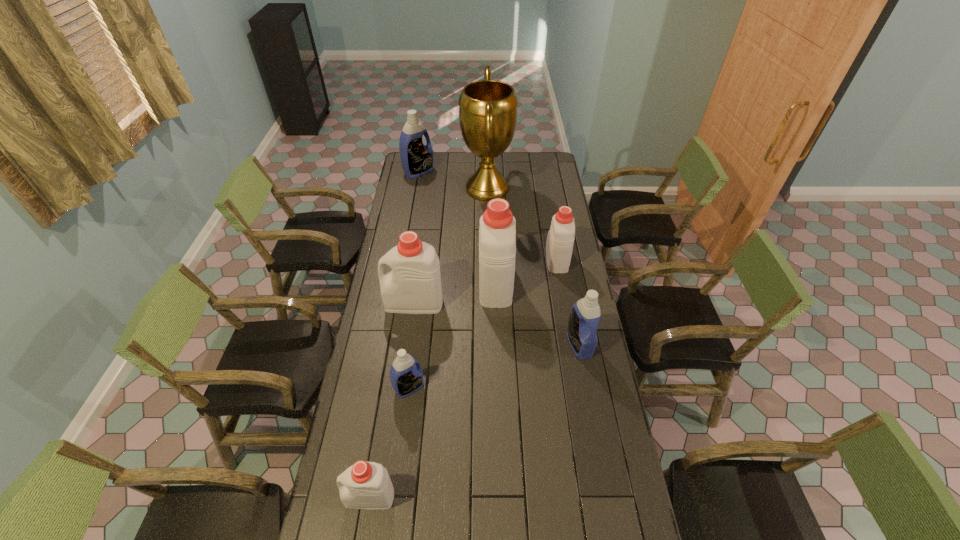
Locate an element on the screen. The width and height of the screenshot is (960, 540). trophy cup is located at coordinates (487, 108).

At what (x,y) coordinates should I click in order to perform the action: click on the tallest object. Please return your answer as a coordinate pair (x, y). The height and width of the screenshot is (540, 960). Looking at the image, I should click on (487, 108).

In order to click on the biggest white detergent in this screenshot , I will do `click(497, 233)`.

The image size is (960, 540). What are the coordinates of `the tallest detergent` in the screenshot? It's located at (497, 233).

Find the location of `the farthest detergent`. the farthest detergent is located at coordinates (417, 159).

Locate an element on the screen. The height and width of the screenshot is (540, 960). the biggest blue detergent is located at coordinates (417, 159).

Identify the location of the second biggest white detergent. (413, 286).

Image resolution: width=960 pixels, height=540 pixels. Identify the location of the rightmost white detergent. (559, 245).

Locate an element on the screen. The image size is (960, 540). the third nearest detergent is located at coordinates (585, 314).

I want to click on the rightmost blue detergent, so click(585, 314).